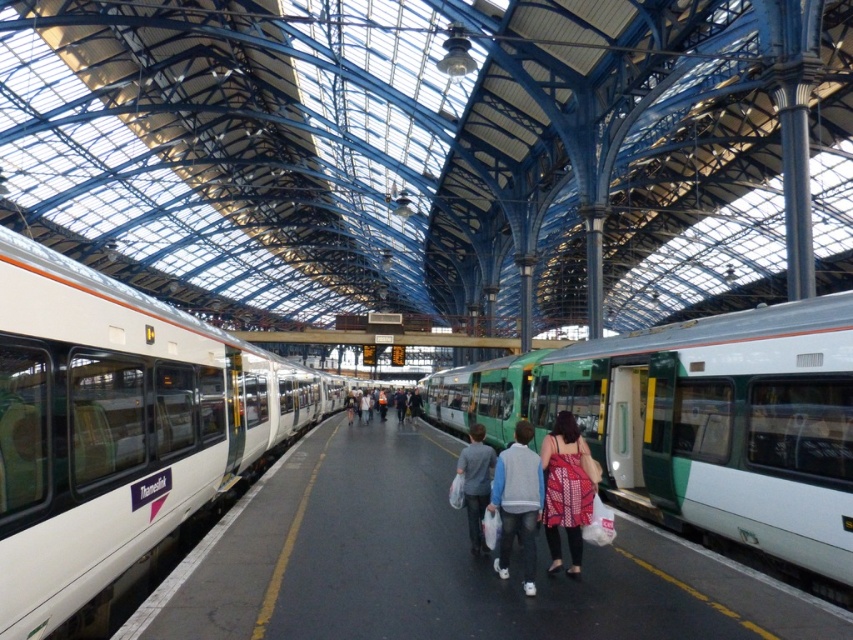
Between point (820, 420) and point (491, 456), which one is positioned in front?

Positioned in front is point (820, 420).

At what (x,y) coordinates should I click in order to perform the action: click on green matte train at center. Please return your answer as a coordinate pair (x, y). This screenshot has width=853, height=640. Looking at the image, I should click on (711, 422).

Is green matte train at center above dotted fabric dress at center?

Incorrect, green matte train at center is not positioned above dotted fabric dress at center.

Who is more distant from viewer, (790, 410) or (572, 433)?

Point (572, 433)

Find the location of `green matte train at center`. green matte train at center is located at coordinates (711, 422).

Is point (90, 461) farther from camera compared to point (502, 552)?

No, (90, 461) is closer to viewer.

Between white glossy train at left and light gray fleece jacket at center, which one appears on the right side from the viewer's perspective?

Positioned to the right is light gray fleece jacket at center.

Measure the distance between point (9, 589) and camera.

Point (9, 589) is 4.21 meters away from camera.

Identify the location of white glossy train at left. (117, 428).